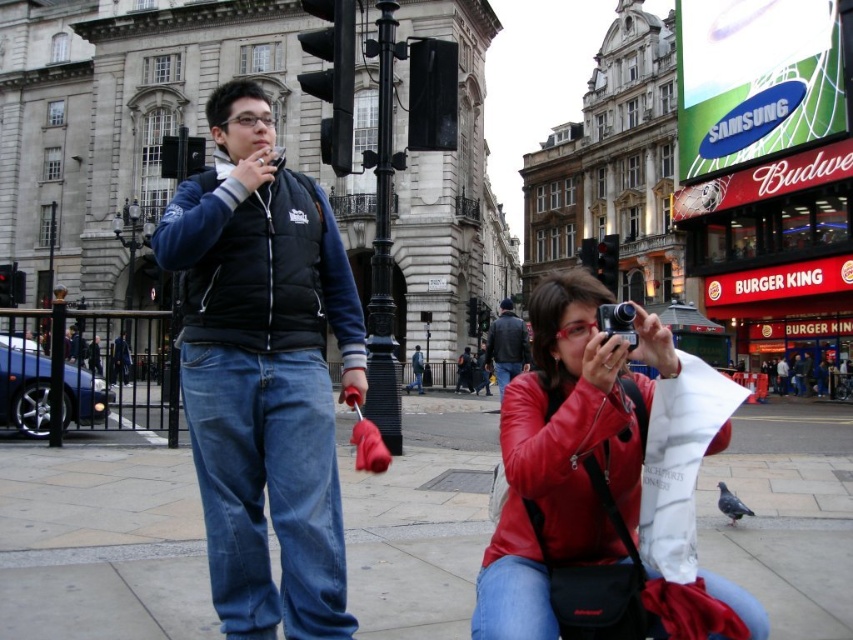
Question: Is matte red leather jacket at lower right behind gray matte pigeon at lower right?

Choices:
 (A) yes
 (B) no

Answer: (B)

Question: Which object appears closest to the camera in this image?

Choices:
 (A) black matte vest at center
 (B) gray matte pigeon at lower right
 (C) leather jacket at center

Answer: (A)

Question: Where is matte red leather jacket at lower right located in relation to leather jacket at center in the image?

Choices:
 (A) left
 (B) right

Answer: (B)

Question: Which point appears closest to the camera in this image?

Choices:
 (A) (479, 592)
 (B) (306, 522)
 (C) (502, 307)
 (D) (724, 508)

Answer: (A)

Question: Which point is closer to the camera?

Choices:
 (A) (735, 499)
 (B) (335, 481)

Answer: (B)

Question: Is black matte vest at center positioned before gray matte pigeon at lower right?

Choices:
 (A) no
 (B) yes

Answer: (B)